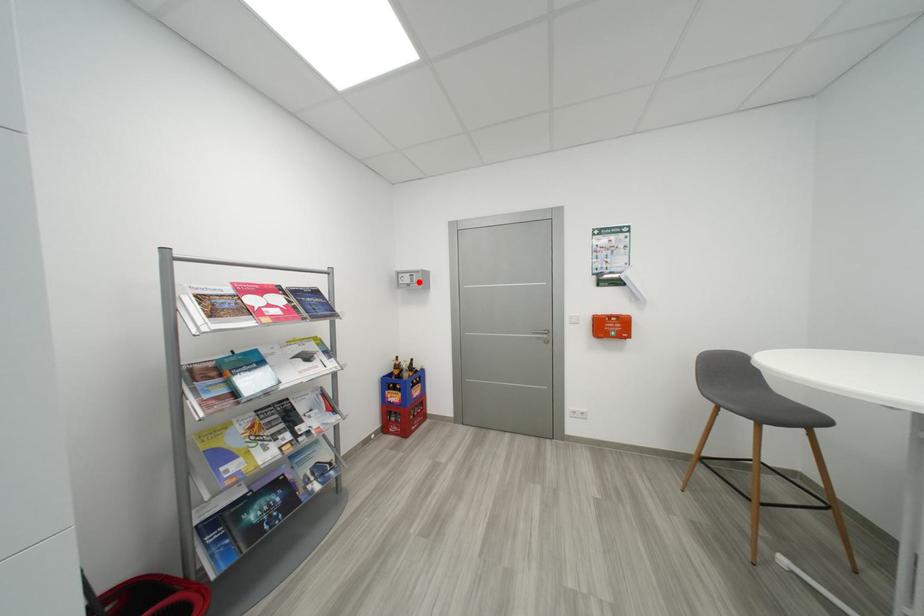
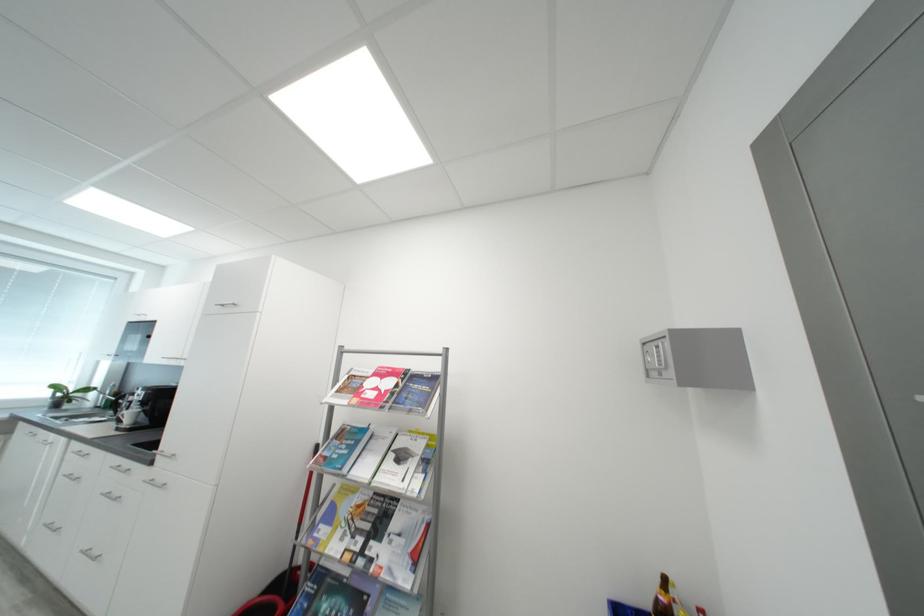
The point at the highlighted location is marked in the first image. Where is the corresponding point in the second image?

(666, 362)